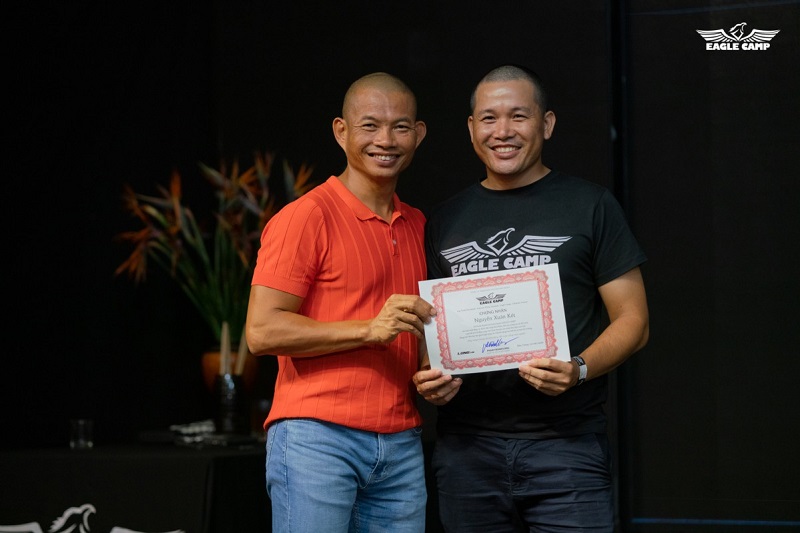
The image size is (800, 533). Identify the location of diploma. (522, 310).